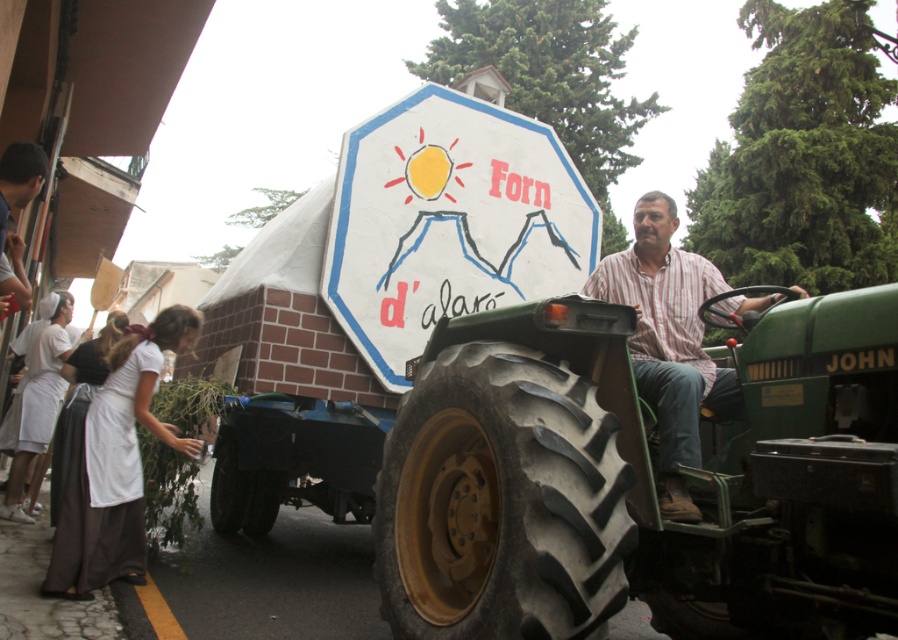
Question: Among these points, which one is nearest to the camera?

Choices:
 (A) (23, 456)
 (B) (333, 285)

Answer: (B)

Question: Estimate the real-world distances between objects in this image. Which object is farther from the white painted sign at center?

Choices:
 (A) white cloth at left
 (B) striped cotton shirt at center
 (C) green rubber tractor at center

Answer: (A)

Question: Is white painted sign at center in front of white cloth at left?

Choices:
 (A) no
 (B) yes

Answer: (B)

Question: Which point is closer to the camera?

Choices:
 (A) white cotton apron at lower left
 (B) white cloth at left
 (C) striped cotton shirt at center

Answer: (C)

Question: Can you confirm if green rubber tractor at center is bigger than striped cotton shirt at center?

Choices:
 (A) yes
 (B) no

Answer: (A)

Question: Can you confirm if white painted sign at center is smaller than striped cotton shirt at center?

Choices:
 (A) yes
 (B) no

Answer: (B)